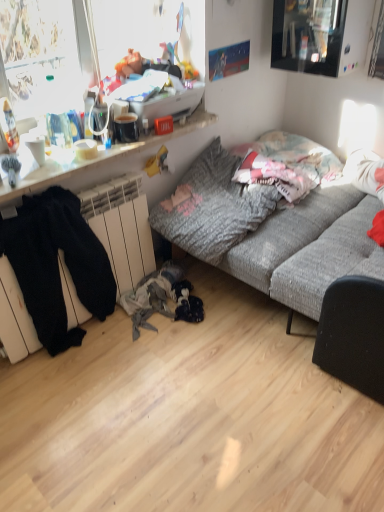
The height and width of the screenshot is (512, 384). I want to click on vacant space positioned to the left of white glossy bowl at upper left, so click(67, 156).